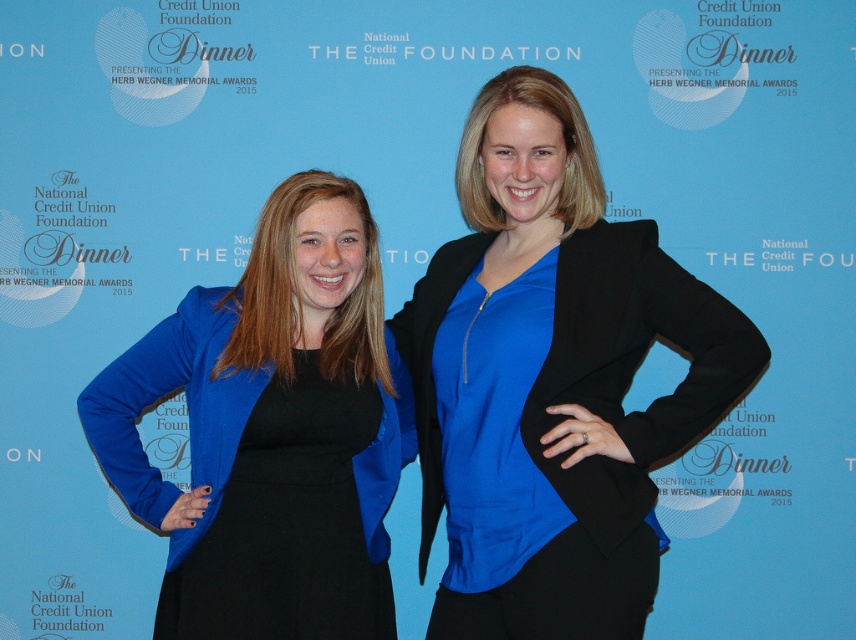
You are a photographer standing at a distance of 2 meters from the scene. You need to capture a closeup shot of the matte blue blazer at center. Is the current distance sufficient to ensure the blazer fills the frame without cropping?

The matte blue blazer at center is 1.88 meters away from the viewer. Since you are standing 2 meters away, you can move 0.12 meters closer to ensure the blazer fills the frame without cropping.